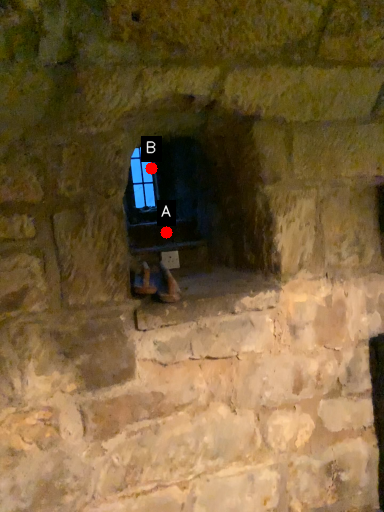
Question: Two points are circled on the image, labeled by A and B beside each circle. Among these points, which one is nearest to the camera?

Choices:
 (A) A is closer
 (B) B is closer

Answer: (A)